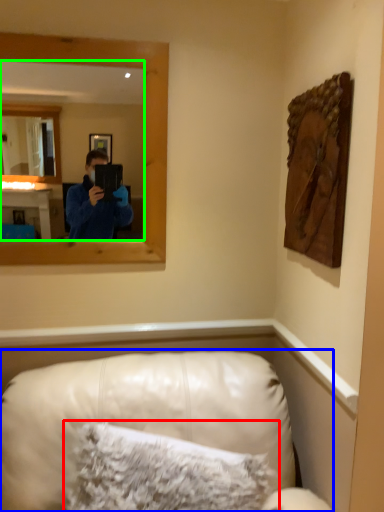
Question: Which object is positioned farthest from pillow (highlighted by a red box)? Select from furniture (highlighted by a blue box) and mirror (highlighted by a green box).

Choices:
 (A) furniture
 (B) mirror

Answer: (B)